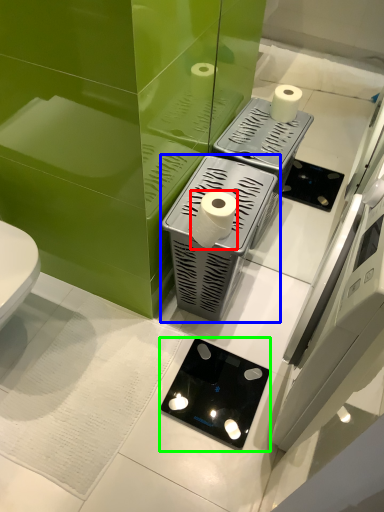
Question: Considering the real-world distances, which object is farthest from toilet paper (highlighted by a red box)? appliance (highlighted by a blue box) or appliance (highlighted by a green box)?

Choices:
 (A) appliance
 (B) appliance

Answer: (B)